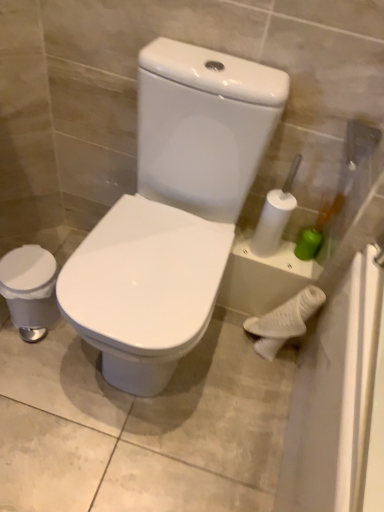
You are a GUI agent. You are given a task and a screenshot of the screen. Output one action in this format:
    pyautogui.click(x=<x>, y=<y>)
    Task: Click on the vacant region to the left of white matte porcelain at lower right, acting as the 1th porcelain starting from the right
    
    Given the screenshot: What is the action you would take?
    pyautogui.click(x=218, y=349)